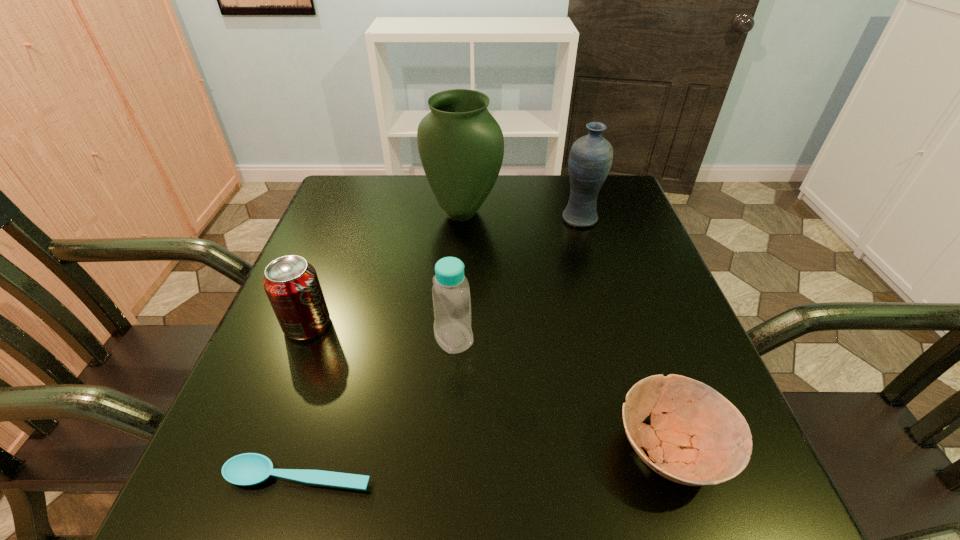
This screenshot has width=960, height=540. I want to click on object that is at the near left corner, so click(247, 469).

Where is `object situated at the far right corner`? This screenshot has width=960, height=540. object situated at the far right corner is located at coordinates (590, 159).

At what (x,y) coordinates should I click in order to perform the action: click on object present at the near right corner. Please return your answer as a coordinate pair (x, y). The image size is (960, 540). Looking at the image, I should click on (703, 439).

Locate an element on the screen. The height and width of the screenshot is (540, 960). vacant region at the far edge is located at coordinates (442, 213).

In the image, there is a desktop. Find the location of `blank space at the near edge`. blank space at the near edge is located at coordinates (582, 480).

I want to click on free space at the left edge of the desktop, so click(354, 272).

The image size is (960, 540). Find the location of `free region at the right edge`. free region at the right edge is located at coordinates (629, 387).

In the image, there is a desktop. At what (x,y) coordinates should I click in order to perform the action: click on vacant space at the far left corner. Please return your answer as a coordinate pair (x, y). The image size is (960, 540). Looking at the image, I should click on (365, 205).

This screenshot has width=960, height=540. In the image, there is a desktop. What are the coordinates of `vacant space at the near right corner` in the screenshot? It's located at (753, 472).

Where is `free space between the bowl and the third shortest object`? free space between the bowl and the third shortest object is located at coordinates (490, 387).